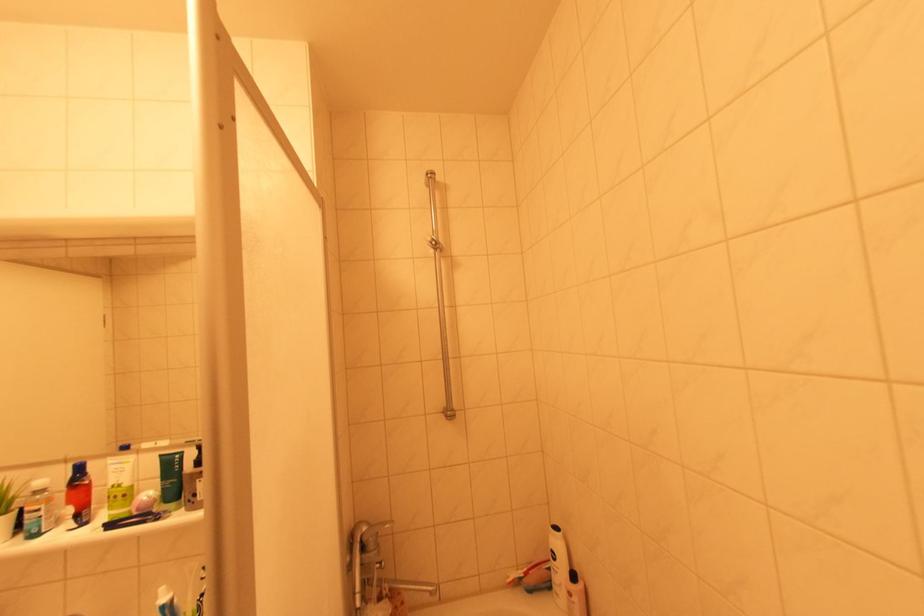
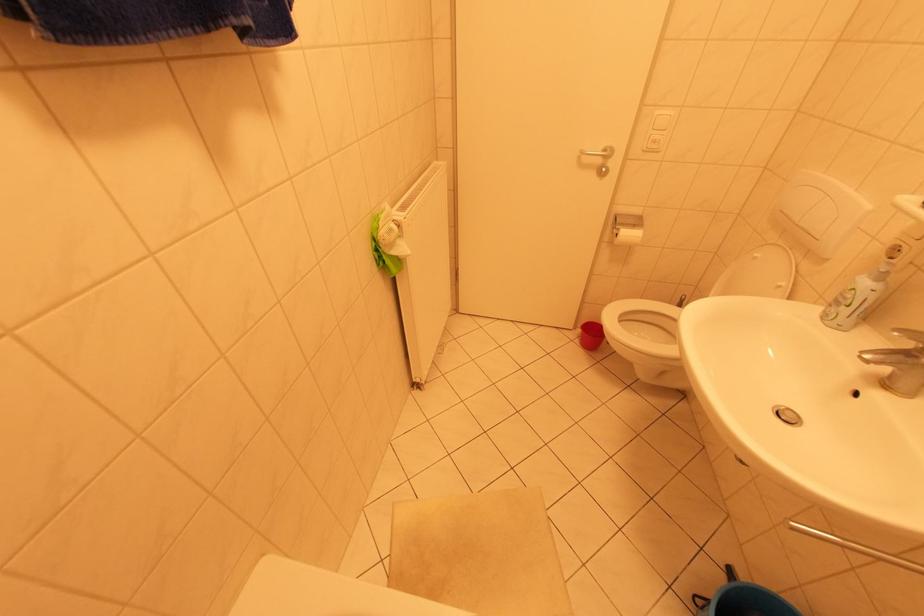
Based on the continuous images, in which direction is the camera rotating?

The camera rotated toward left-down.